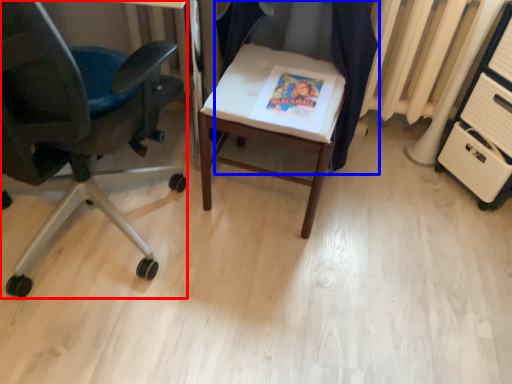
Question: Which object is closer to the camera taking this photo, chair (highlighted by a red box) or chair (highlighted by a blue box)?

Choices:
 (A) chair
 (B) chair

Answer: (A)